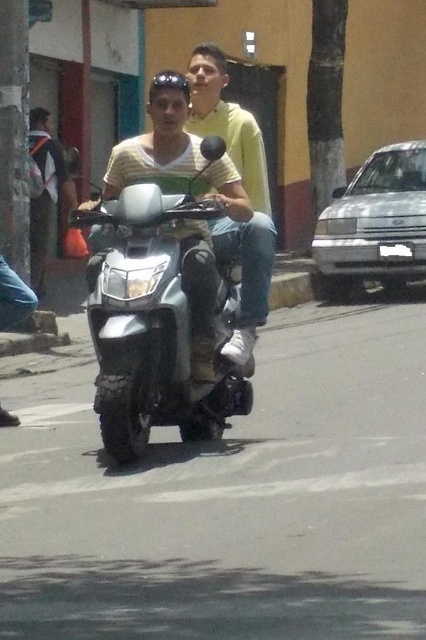
You are a delivery robot navigating the street shown in the image. You need to move from point A at point (120, 230) to point B at point (247, 248). Since point A is in front of point B, will you have to move backward to reach point B from point A?

Point (120, 230) is in front of point (247, 248). To move from point A to point B, you would need to move backward since point B is behind point A.